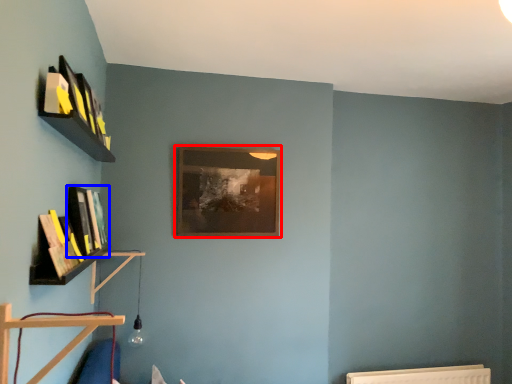
Question: Among these objects, which one is nearest to the camera, picture frame (highlighted by a red box) or book (highlighted by a blue box)?

Choices:
 (A) picture frame
 (B) book

Answer: (B)